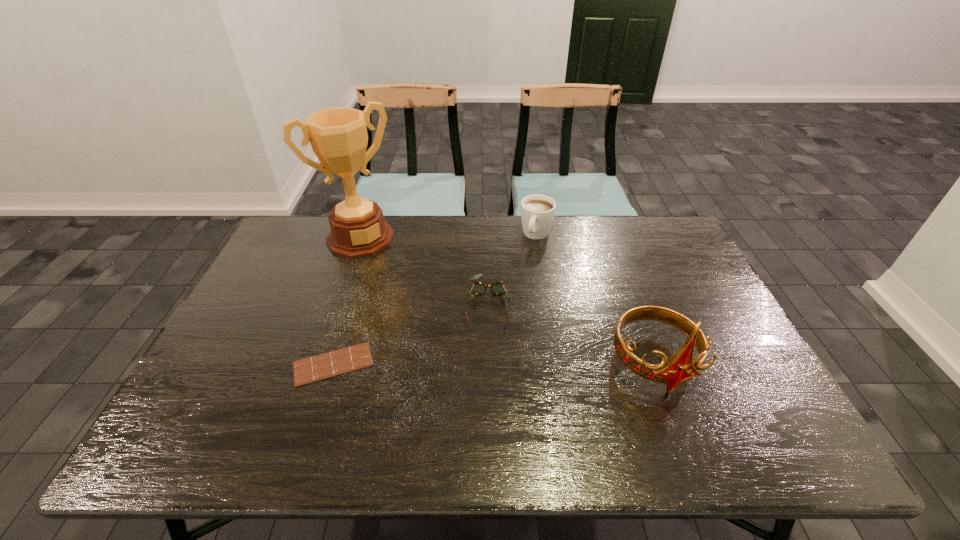
The width and height of the screenshot is (960, 540). In order to click on free space on the desktop that is between the shortest object and the second tallest object and is positioned with the handle on the side of the third tallest object in this screenshot , I will do `click(477, 363)`.

I want to click on free space on the desktop that is between the shortest object and the tiara and is positioned on the front-facing side of the spectacles, so click(x=486, y=363).

The height and width of the screenshot is (540, 960). I want to click on free space on the desktop that is between the chocolate bar and the rightmost object and is positioned on the front-facing side of the award, so click(x=452, y=363).